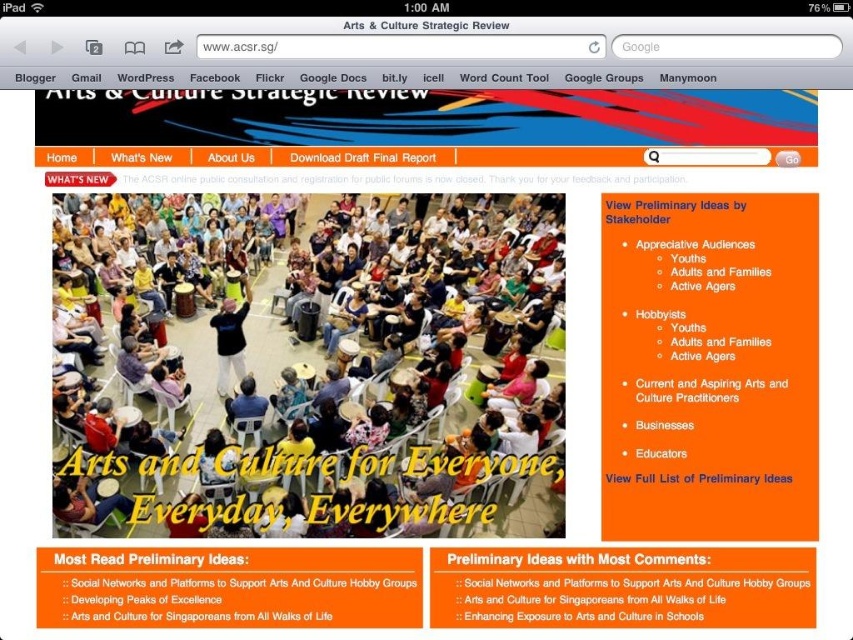
Question: Observing the image, what is the correct spatial positioning of matte plastic chairs at lower center in reference to black matte shirt at center?

Choices:
 (A) left
 (B) right

Answer: (B)

Question: Can you confirm if matte plastic chairs at lower center is bigger than black matte shirt at center?

Choices:
 (A) no
 (B) yes

Answer: (A)

Question: Which of the following is the farthest from the observer?

Choices:
 (A) 189,371
 (B) 216,342

Answer: (A)

Question: Does matte plastic chairs at lower center appear over black matte shirt at center?

Choices:
 (A) yes
 (B) no

Answer: (B)